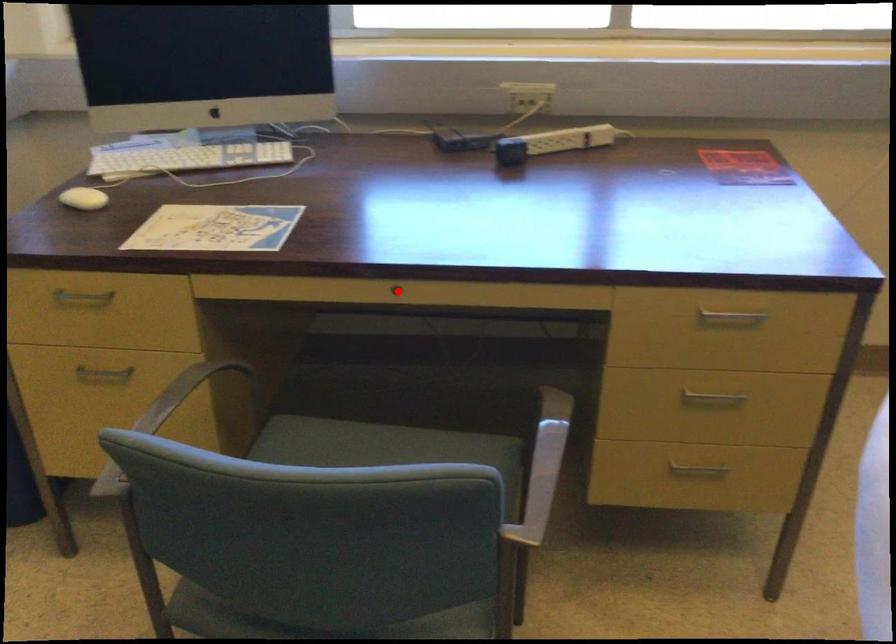
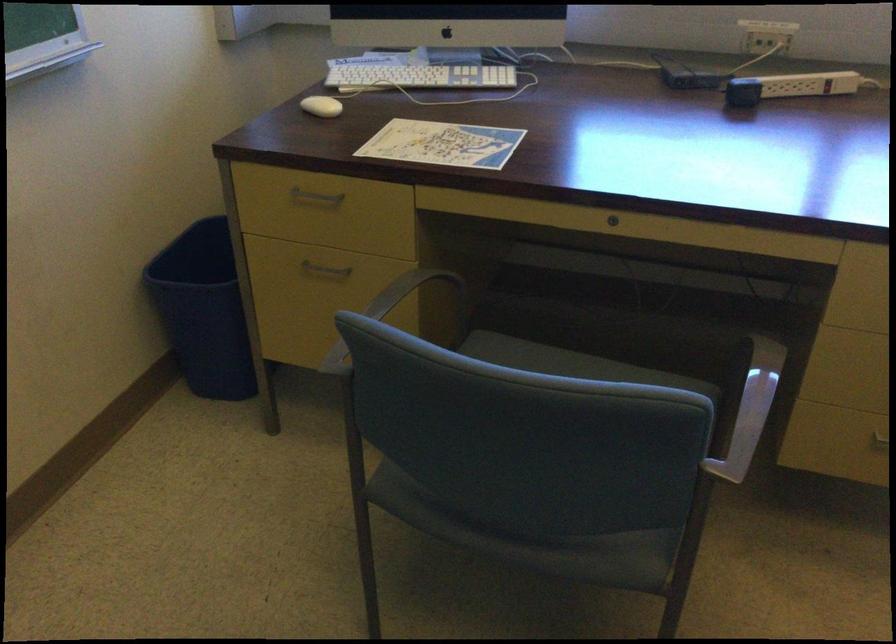
Where in the second image is the point corresponding to the highlighted location from the first image?

(613, 220)